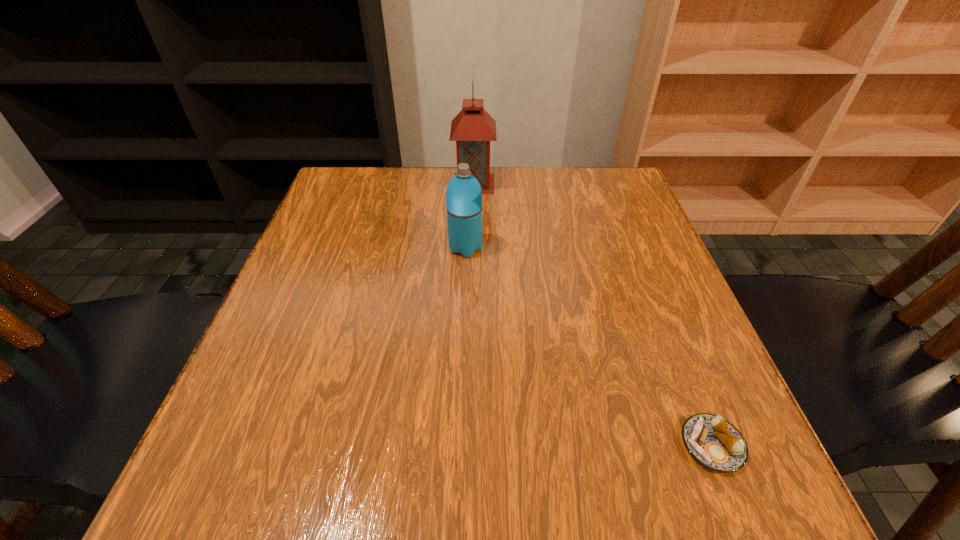
Identify the location of vacant point located between the shortest object and the farthest object. The width and height of the screenshot is (960, 540). (593, 314).

I want to click on free spot between the pastry and the second nearest object, so click(588, 347).

At what (x,y) coordinates should I click in order to perform the action: click on empty space between the shortest object and the second tallest object. Please return your answer as a coordinate pair (x, y). The image size is (960, 540). Looking at the image, I should click on (588, 347).

This screenshot has height=540, width=960. I want to click on empty space that is in between the second shortest object and the nearest object, so click(x=588, y=347).

In order to click on vacant point located between the shortest object and the thermos bottle in this screenshot , I will do `click(588, 347)`.

The width and height of the screenshot is (960, 540). Find the location of `vacant space that's between the second nearest object and the nearest object`. vacant space that's between the second nearest object and the nearest object is located at coordinates (588, 347).

Select which object is the closest to the pastry. Please provide its 2D coordinates. Your answer should be formatted as a tuple, i.e. [(x, y)], where the tuple contains the x and y coordinates of a point satisfying the conditions above.

[(463, 195)]

Identify which object is the nearest to the lantern. Please provide its 2D coordinates. Your answer should be formatted as a tuple, i.e. [(x, y)], where the tuple contains the x and y coordinates of a point satisfying the conditions above.

[(463, 195)]

Find the location of a particular element. The height and width of the screenshot is (540, 960). vacant region that satisfies the following two spatial constraints: 1. on the front side of the tallest object; 2. on the left side of the rightmost object is located at coordinates point(468,445).

This screenshot has height=540, width=960. I want to click on blank space that satisfies the following two spatial constraints: 1. on the front side of the shortest object; 2. on the right side of the farthest object, so click(468, 445).